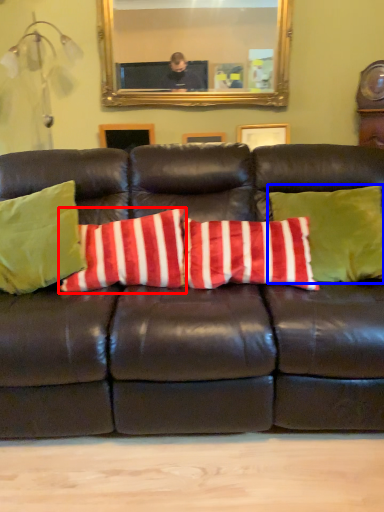
Question: Which point is further to the camera, pillow (highlighted by a red box) or pillow (highlighted by a blue box)?

Choices:
 (A) pillow
 (B) pillow

Answer: (A)